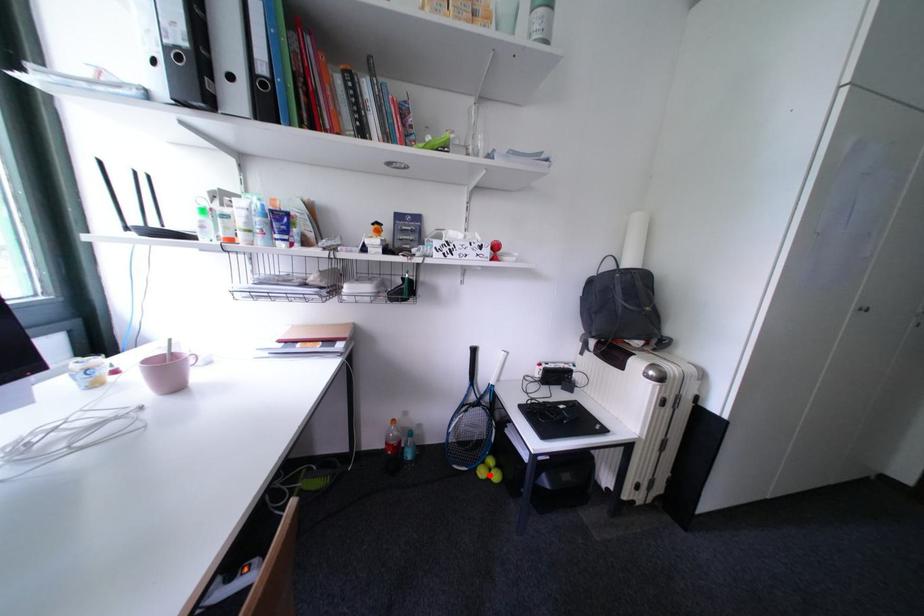
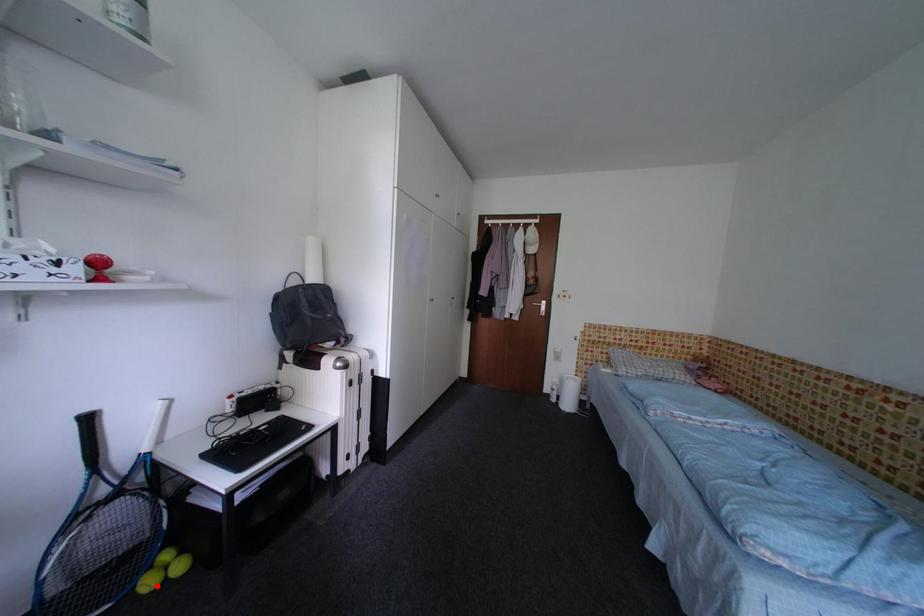
I am providing you with two images of the same scene from different viewpoints. A red point is marked on the first image and another point is marked on the second image. Is the marked point in image1 the same physical position as the marked point in image2?

Yes